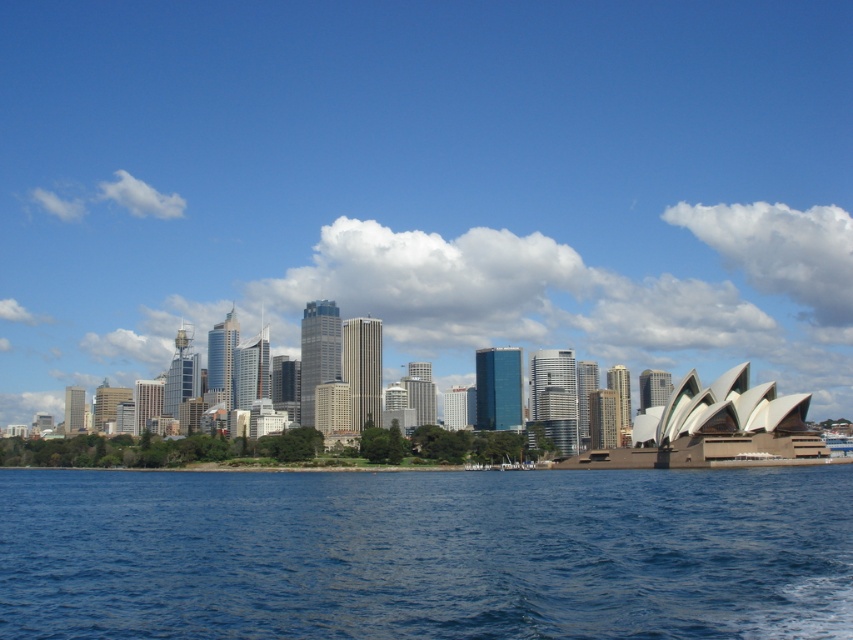
How much distance is there between transparent glass skyline at center and blue water at lower center?

transparent glass skyline at center is 271.08 meters from blue water at lower center.

Is transparent glass skyline at center bigger than blue water at lower center?

Indeed, transparent glass skyline at center has a larger size compared to blue water at lower center.

At what (x,y) coordinates should I click in order to perform the action: click on transparent glass skyline at center. Please return your answer as a coordinate pair (x, y). This screenshot has height=640, width=853. Looking at the image, I should click on (427, 182).

Locate an element on the screen. This screenshot has height=640, width=853. transparent glass skyline at center is located at coordinates (427, 182).